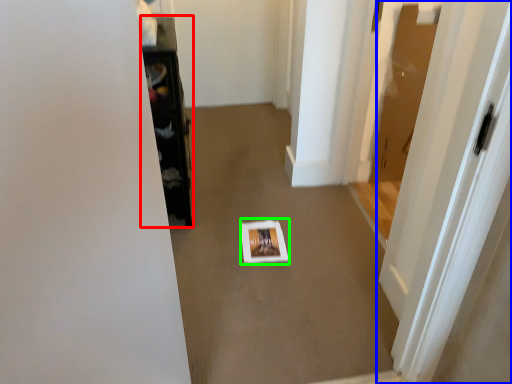
Question: Considering the real-world distances, which object is closest to furniture (highlighted by a red box)? door (highlighted by a blue box) or square (highlighted by a green box).

Choices:
 (A) door
 (B) square

Answer: (B)